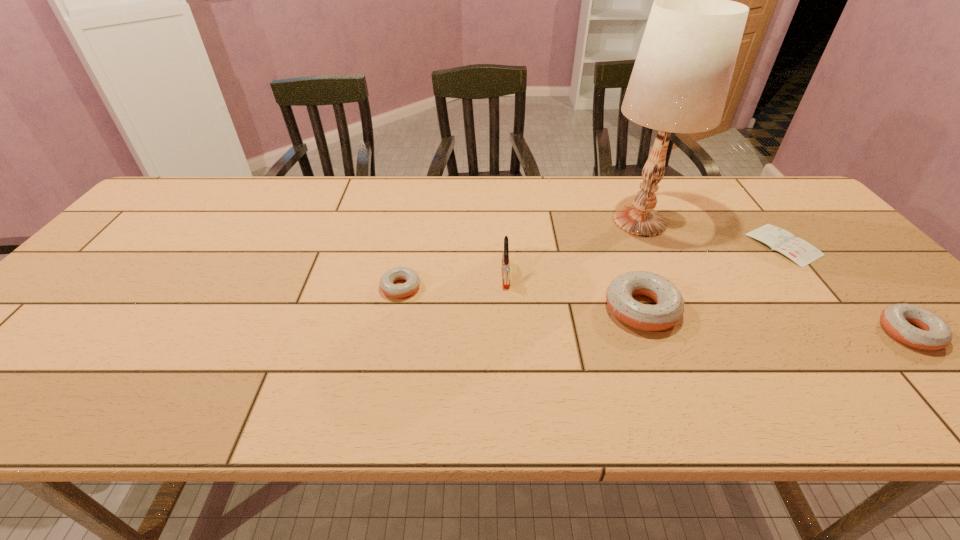
This screenshot has height=540, width=960. What are the coordinates of `the fifth tallest object` in the screenshot? It's located at (412, 279).

Image resolution: width=960 pixels, height=540 pixels. Find the location of `the leftmost doughnut`. the leftmost doughnut is located at coordinates (412, 279).

Where is `the second doughnut from right to left`? The width and height of the screenshot is (960, 540). the second doughnut from right to left is located at coordinates (669, 309).

The image size is (960, 540). In order to click on the tallest doughnut in this screenshot , I will do `click(669, 309)`.

This screenshot has height=540, width=960. In order to click on the rightmost doughnut in this screenshot , I will do `click(934, 334)`.

Locate an element on the screen. The image size is (960, 540). the second tallest doughnut is located at coordinates (934, 334).

This screenshot has height=540, width=960. I want to click on the shortest object, so click(798, 250).

The height and width of the screenshot is (540, 960). Identify the location of lamp. (681, 77).

What are the coordinates of `the fifth shortest object` in the screenshot? It's located at (506, 267).

Identify the location of the second object from left to right. (506, 267).